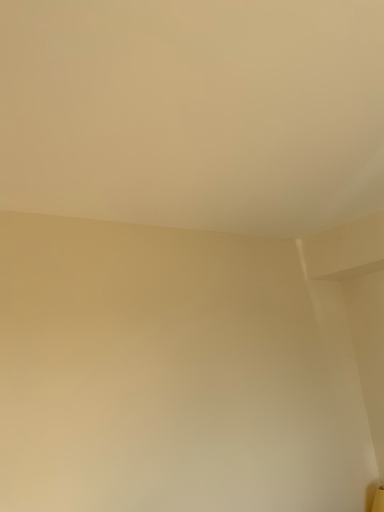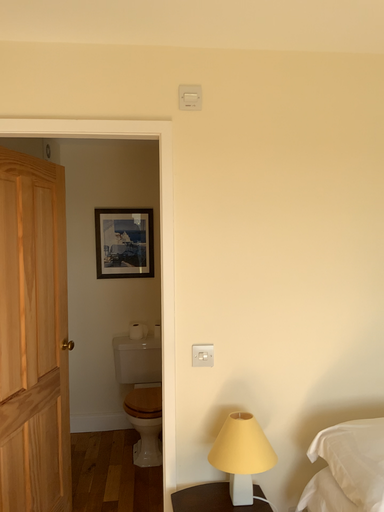
Question: How did the camera likely rotate when shooting the video?

Choices:
 (A) rotated left
 (B) rotated right

Answer: (A)